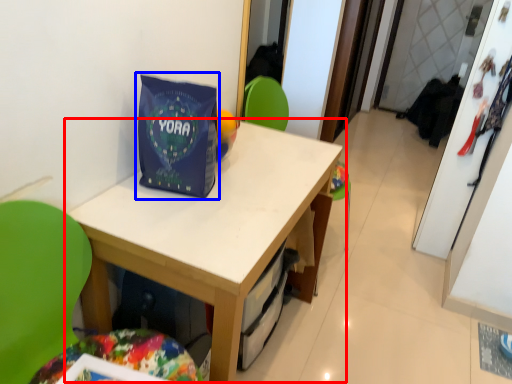
Question: Which object is closer to the camera taking this photo, table (highlighted by a red box) or gift bag (highlighted by a blue box)?

Choices:
 (A) table
 (B) gift bag

Answer: (A)